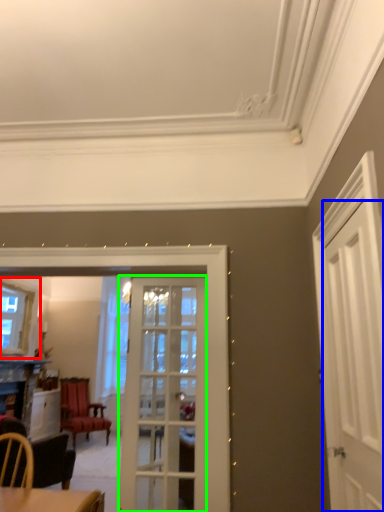
Question: Which is nearer to the window (highlighted by a red box)? door (highlighted by a blue box) or door (highlighted by a green box).

Choices:
 (A) door
 (B) door

Answer: (B)